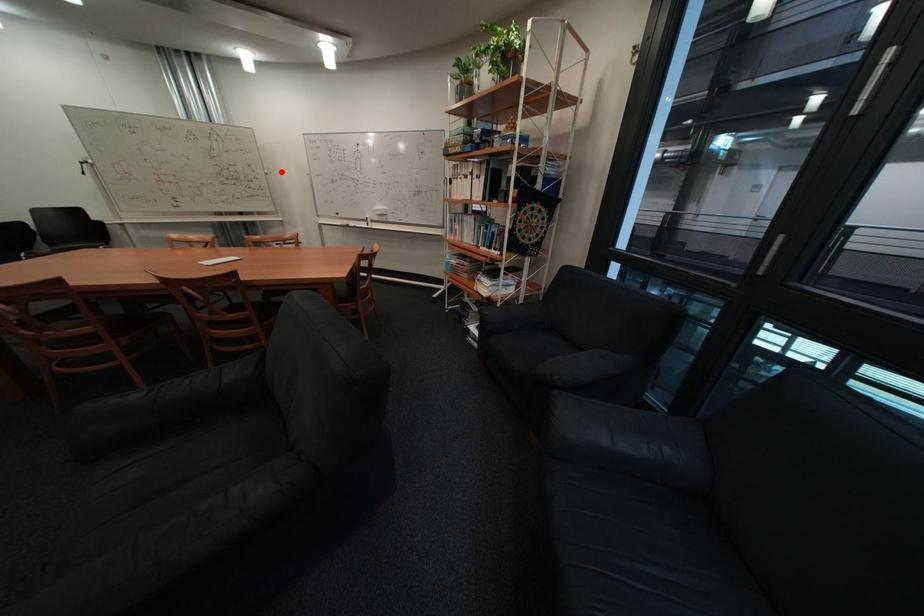
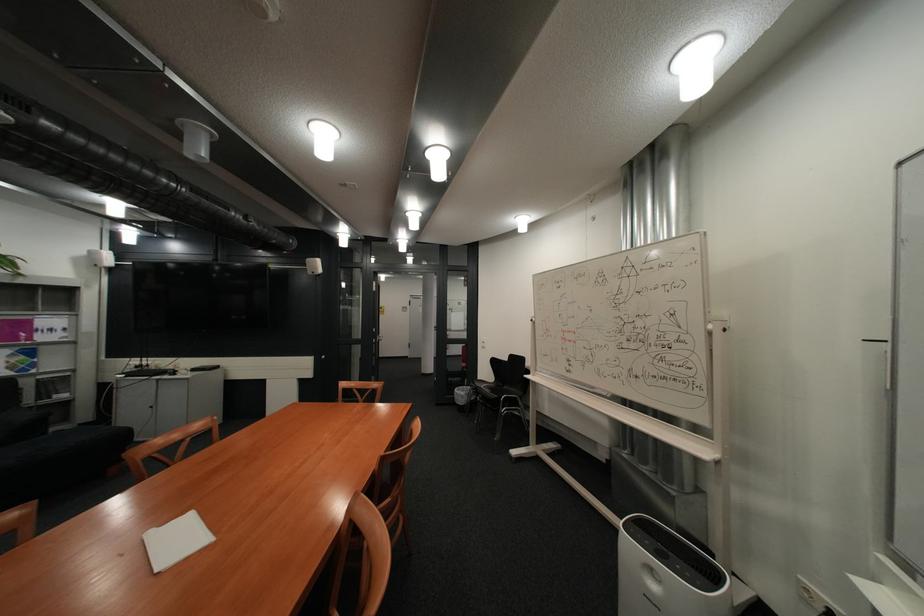
Locate, in the second image, the point that corresponds to the highlighted location in the first image.

(725, 326)